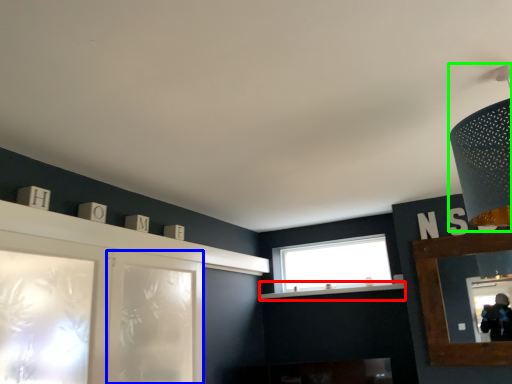
Question: Which object is the farthest from mantle (highlighted by a red box)? Choose among these: screen door (highlighted by a blue box) or light fixture (highlighted by a green box).

Choices:
 (A) screen door
 (B) light fixture

Answer: (B)